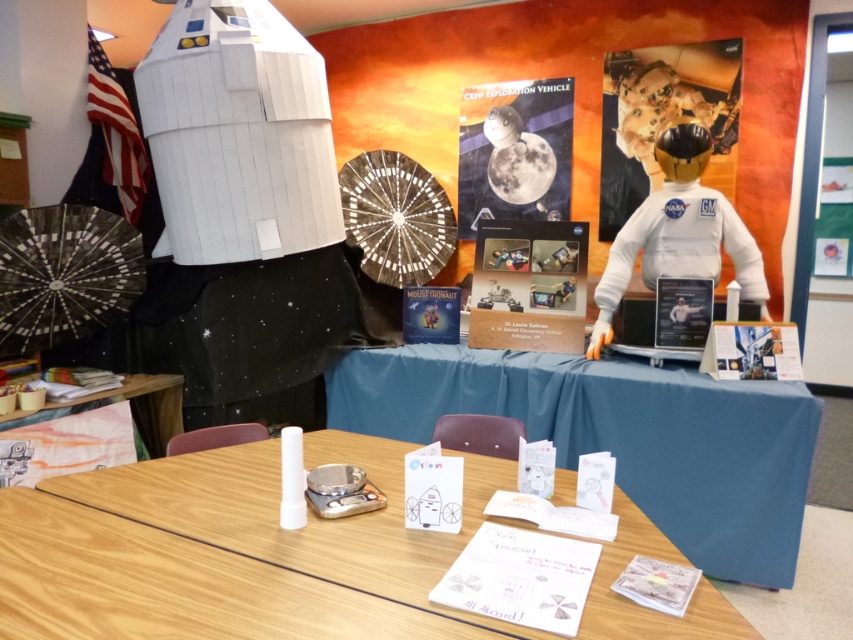
Question: Which object is positioned closest to the white paper at center?

Choices:
 (A) matte green poster at upper right
 (B) wooden table at lower left

Answer: (B)

Question: Considering the real-world distances, which object is closest to the gold metallic astronaut suit at upper right?

Choices:
 (A) white fabric astronaut at right
 (B) matte green poster at upper right
 (C) wooden table at lower left
 (D) white paper at center

Answer: (A)

Question: Which of the following is the closest to the observer?

Choices:
 (A) white cardboard rocket at left
 (B) matte green poster at upper right
 (C) white fabric astronaut at right

Answer: (A)

Question: In this image, where is glossy paper poster at center located relative to glossy plastic certificate at center?

Choices:
 (A) left
 (B) right

Answer: (B)

Question: Does white cardboard rocket at left have a greater width compared to gold metallic astronaut suit at upper right?

Choices:
 (A) no
 (B) yes

Answer: (B)

Question: Is the position of matte green poster at upper right more distant than that of glossy plastic certificate at center?

Choices:
 (A) yes
 (B) no

Answer: (A)